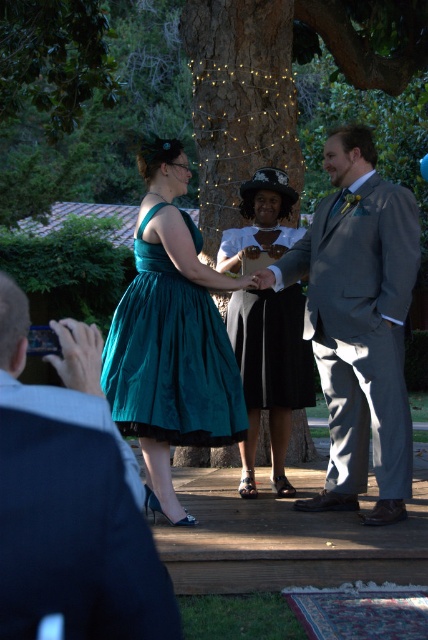
Between point (195, 387) and point (77, 384), which one is positioned in front?

Positioned in front is point (77, 384).

Can you confirm if teal satin dress at center is taller than smooth skin hand at lower left?

Indeed, teal satin dress at center has a greater height compared to smooth skin hand at lower left.

Does point (118, 333) come farther from viewer compared to point (74, 355)?

That is True.

What are the coordinates of `teal satin dress at center` in the screenshot? It's located at (171, 356).

Is point (262, 285) positioned after point (83, 360)?

That is True.

The width and height of the screenshot is (428, 640). Describe the element at coordinates (359, 323) in the screenshot. I see `gray suit at center` at that location.

Where is `gray suit at center`? gray suit at center is located at coordinates (359, 323).

Between point (88, 445) and point (394, 243), which one is positioned in front?

Positioned in front is point (88, 445).

Between matte gray suit at center and gray suit at center, which one has more height?

With more height is gray suit at center.

Who is more distant from viewer, (92,563) or (365,260)?

Point (365,260)

Locate an element on the screen. matte gray suit at center is located at coordinates pos(71,499).